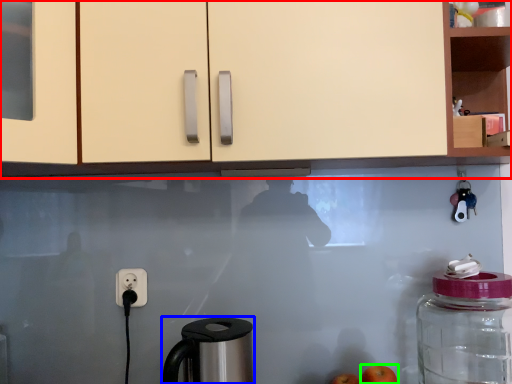
Question: Based on their relative distances, which object is nearer to cabinetry (highlighted by a red box)? Choose from coffee maker (highlighted by a blue box) and apple (highlighted by a green box).

Choices:
 (A) coffee maker
 (B) apple

Answer: (A)